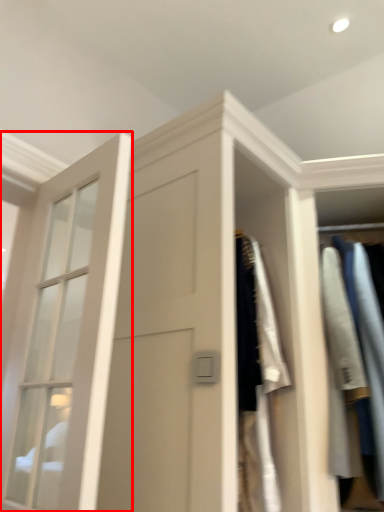
Question: Where is window (annotated by the red box) located in relation to clothing in the image?

Choices:
 (A) right
 (B) left

Answer: (B)